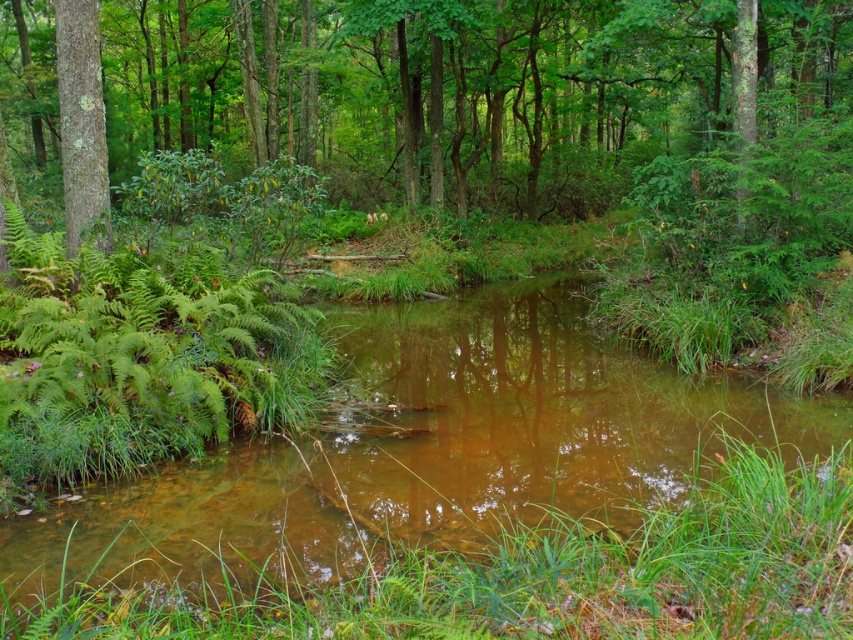
What is the exact location of the clear water stream at center in the image?

The clear water stream at center is located at point (x=473, y=500).

You are standing in the forest scene and want to take a photo of the green leafy tree at center. If your camera has a maximum focus range of 8 meters, will you be able to capture the tree clearly?

The green leafy tree at center is 8.09 meters from viewer, so it is slightly beyond the camera maximum focus range of 8 meters. The camera may not be able to focus clearly on the tree.

You are standing in the forest scene and want to place a small marker at each of the two points labeled point (x=779, y=19) and point (x=59, y=58). Which point is closer to you when you look at the scene?

Point (x=59, y=58) is closer to you because it is less further to the camera than point (x=779, y=19).